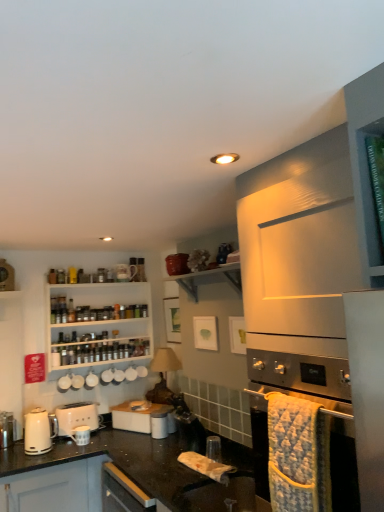
Question: Is white glossy shelf at upper center not inside white matte toaster at lower left, which is the 2th kitchen appliance from front to back?

Choices:
 (A) yes
 (B) no

Answer: (A)

Question: Is white glossy shelf at upper center looking in the opposite direction of white matte toaster at lower left, which is the 2th kitchen appliance from front to back?

Choices:
 (A) no
 (B) yes

Answer: (A)

Question: Considering the relative sizes of white glossy shelf at upper center and white matte toaster at lower left, which is the 1th kitchen appliance from back to front, in the image provided, is white glossy shelf at upper center wider than white matte toaster at lower left, which is the 1th kitchen appliance from back to front,?

Choices:
 (A) no
 (B) yes

Answer: (B)

Question: Considering the relative sizes of white glossy shelf at upper center and white matte toaster at lower left, which is the 2th kitchen appliance from front to back, in the image provided, is white glossy shelf at upper center thinner than white matte toaster at lower left, which is the 2th kitchen appliance from front to back,?

Choices:
 (A) no
 (B) yes

Answer: (A)

Question: From a real-world perspective, does white glossy shelf at upper center sit lower than white matte toaster at lower left, which is the 1th kitchen appliance from back to front?

Choices:
 (A) no
 (B) yes

Answer: (A)

Question: Can you see white glossy shelf at upper center touching white matte toaster at lower left, which is the 2th kitchen appliance from front to back?

Choices:
 (A) no
 (B) yes

Answer: (A)

Question: Are white glossy shelf at upper center and white wooden shelves at upper left beside each other?

Choices:
 (A) no
 (B) yes

Answer: (A)

Question: Can you confirm if white glossy shelf at upper center is thinner than white wooden shelves at upper left?

Choices:
 (A) no
 (B) yes

Answer: (A)

Question: Does white glossy shelf at upper center lie behind white wooden shelves at upper left?

Choices:
 (A) yes
 (B) no

Answer: (B)

Question: Is white glossy shelf at upper center at the right side of white wooden shelves at upper left?

Choices:
 (A) yes
 (B) no

Answer: (A)

Question: Can you confirm if white glossy shelf at upper center is shorter than white wooden shelves at upper left?

Choices:
 (A) yes
 (B) no

Answer: (A)

Question: Does white glossy shelf at upper center have a larger size compared to white wooden shelves at upper left?

Choices:
 (A) no
 (B) yes

Answer: (A)

Question: Does white matte toaster at lower left, which is the 1th kitchen appliance from back to front, turn towards stainless steel oven at lower right?

Choices:
 (A) no
 (B) yes

Answer: (B)